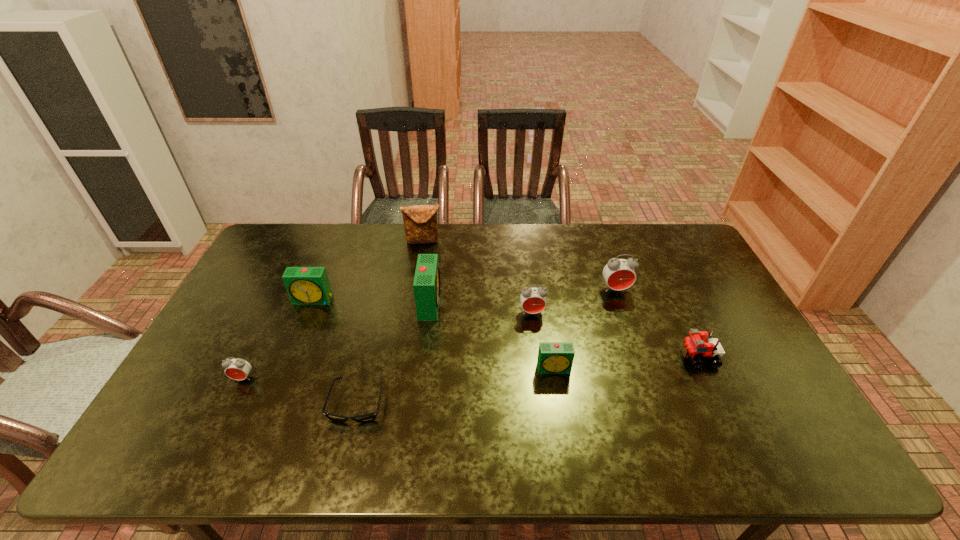
This screenshot has height=540, width=960. In the image, there is a desktop. In order to click on free space at the near edge in this screenshot , I will do `click(409, 430)`.

Find the location of a particular element. Image resolution: width=960 pixels, height=540 pixels. vacant space at the left edge of the desktop is located at coordinates (268, 285).

You are a GUI agent. You are given a task and a screenshot of the screen. Output one action in this format:
    pyautogui.click(x=<x>, y=<y>)
    Task: Click on the free region at the right edge
    The image size is (960, 540).
    Given the screenshot: What is the action you would take?
    pyautogui.click(x=751, y=405)

In the image, there is a desktop. Identify the location of vacant space at the far left corner. The width and height of the screenshot is (960, 540). click(x=271, y=242).

Locate an element on the screen. free region at the far right corner of the desktop is located at coordinates (680, 245).

Find the location of `vacant space at the near right corner`. vacant space at the near right corner is located at coordinates (751, 447).

Locate an element on the screen. empty space between the smallest green alarm clock and the sunglasses is located at coordinates (456, 386).

Image resolution: width=960 pixels, height=540 pixels. Identify the location of vacant space in between the rightmost green alarm clock and the red Lego. pos(626,363).

You are a GUI agent. You are given a task and a screenshot of the screen. Output one action in this format:
    pyautogui.click(x=<x>, y=<y>)
    Task: Click on the vacant space that's between the biggest green alarm clock and the Lego
    This screenshot has height=540, width=960.
    Given the screenshot: What is the action you would take?
    (564, 330)

The height and width of the screenshot is (540, 960). Find the location of `unoccupied position between the clutch bag and the second biggest red alarm clock`. unoccupied position between the clutch bag and the second biggest red alarm clock is located at coordinates (478, 277).